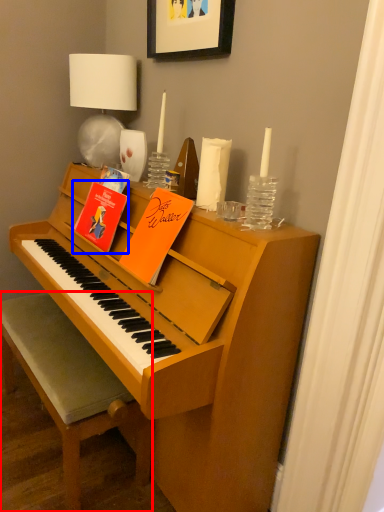
Question: Which of the following is the closest to the observer, chair (highlighted by a red box) or paperback book (highlighted by a blue box)?

Choices:
 (A) chair
 (B) paperback book

Answer: (A)